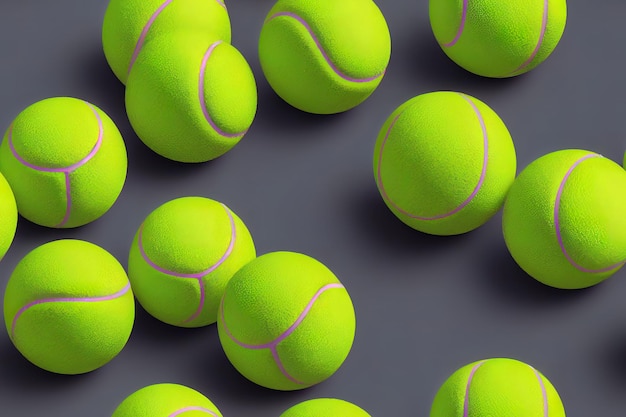
You are a GUI agent. You are given a task and a screenshot of the screen. Output one action in this format:
    pyautogui.click(x=<x>, y=<y>)
    Task: Click on the table
    This screenshot has width=626, height=417.
    Given the screenshot: What is the action you would take?
    pyautogui.click(x=305, y=193)